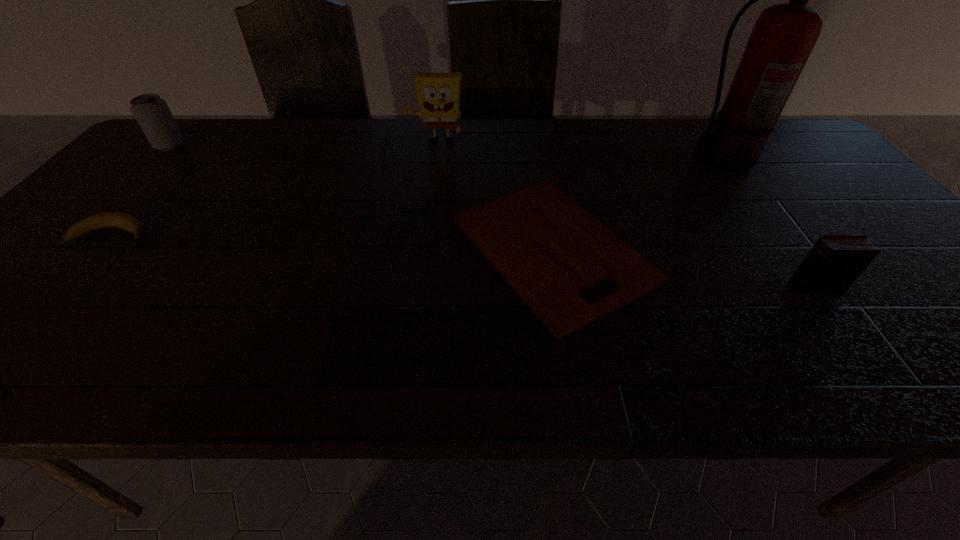
Where is `the tallest object`? the tallest object is located at coordinates (784, 35).

Locate an element on the screen. Image resolution: width=960 pixels, height=540 pixels. sponge is located at coordinates (438, 93).

Where is `can`? can is located at coordinates pos(152,113).

You are a GUI agent. You are given a task and a screenshot of the screen. Output one action in this format:
    pyautogui.click(x=<x>, y=<y>)
    Task: Click on the fourth tallest object
    
    Given the screenshot: What is the action you would take?
    pyautogui.click(x=833, y=264)

Find the location of a particular element. the second shortest object is located at coordinates (124, 221).

What are the coordinates of `the shortest object` in the screenshot? It's located at (549, 249).

Locate an element on the screen. The height and width of the screenshot is (540, 960). free space located 0.280m on the nozzle of the tallest object is located at coordinates (585, 159).

Find the location of a particular element. This screenshot has width=960, height=540. free space located on the nozzle of the tallest object is located at coordinates (661, 159).

The image size is (960, 540). Find the location of `vacant space located on the nozzle of the tallest object`. vacant space located on the nozzle of the tallest object is located at coordinates (547, 159).

Identify the location of vacant area located on the face of the second tallest object. pyautogui.click(x=434, y=159).